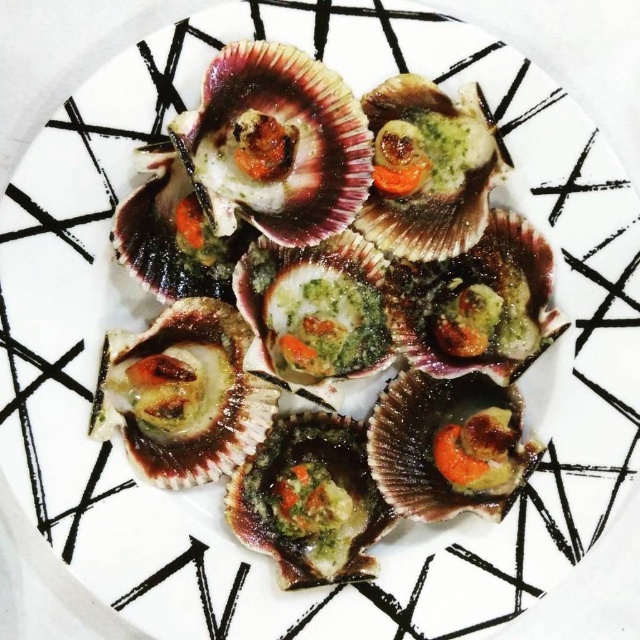
Question: In this image, where is green matte scallop at center located relative to shiny brown shellfish at center?

Choices:
 (A) right
 (B) left

Answer: (B)

Question: Among these points, which one is farthest from the camera?

Choices:
 (A) (262, 384)
 (B) (252, 456)

Answer: (A)

Question: Is green matte scallop at center below shiny brown shellfish at center?

Choices:
 (A) no
 (B) yes

Answer: (A)

Question: Which point is farther to the camera?

Choices:
 (A) shiny brown shellfish at center
 (B) green matte scallop at center

Answer: (A)

Question: Can you confirm if green matte scallop at center is positioned above shiny brown shellfish at center?

Choices:
 (A) no
 (B) yes

Answer: (B)

Question: Which point is closer to the camera?

Choices:
 (A) green matte scallop at center
 (B) shiny brown shellfish at center

Answer: (A)